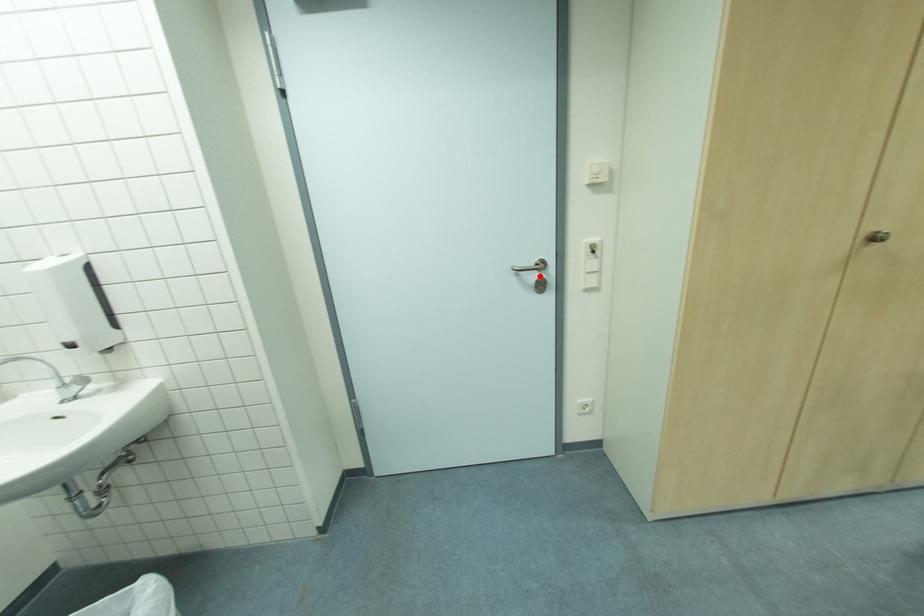
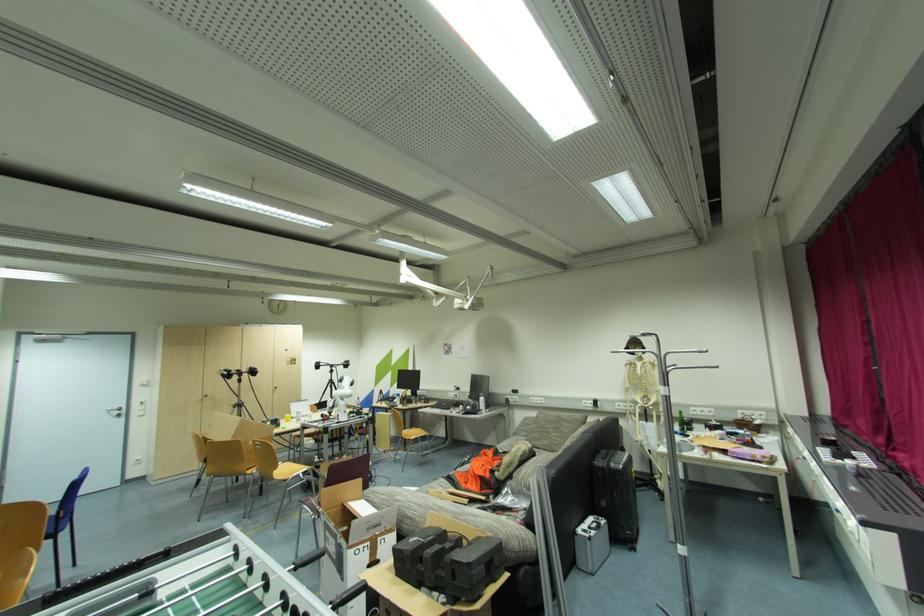
The point at the highlighted location is marked in the first image. Where is the corresponding point in the second image?

(122, 413)